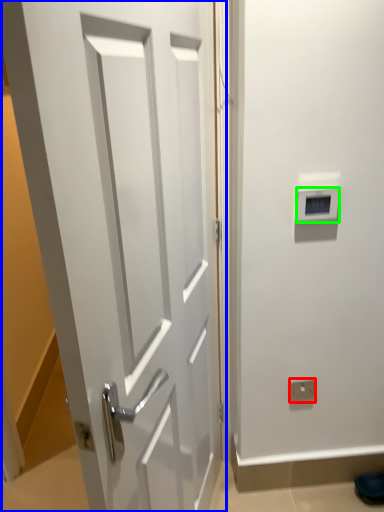
Question: Which is nearer to the electric outlet (highlighted by a red box)? door (highlighted by a blue box) or thermostat (highlighted by a green box).

Choices:
 (A) door
 (B) thermostat

Answer: (B)